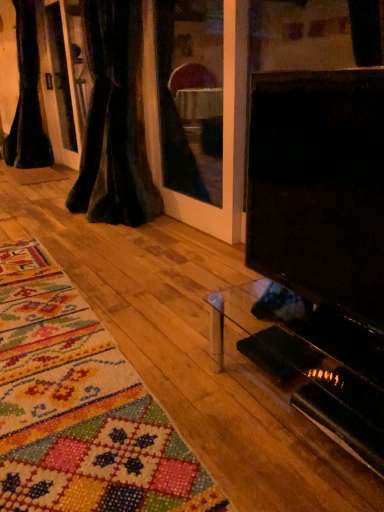
Image resolution: width=384 pixels, height=512 pixels. Describe the element at coordinates (114, 121) in the screenshot. I see `velvet dark at left, arranged as the 2th curtain when viewed from the left` at that location.

The image size is (384, 512). What are the coordinates of `velvet dark at left, arranged as the 2th curtain when viewed from the left` in the screenshot? It's located at (114, 121).

Describe the element at coordinates (319, 187) in the screenshot. I see `black glossy tv at right` at that location.

Where is `velvet dark at left, which appears as the 1th curtain when viewed from the right`? The image size is (384, 512). velvet dark at left, which appears as the 1th curtain when viewed from the right is located at coordinates (114, 121).

From the image's perspective, which one is positioned higher, black velvet curtain at left, arranged as the first curtain when viewed from the back, or black glossy tv at right?

black velvet curtain at left, arranged as the first curtain when viewed from the back, from the image's perspective.

Considering the sizes of black velvet curtain at left, marked as the 2th curtain in a front-to-back arrangement, and black glossy tv at right in the image, is black velvet curtain at left, marked as the 2th curtain in a front-to-back arrangement, taller or shorter than black glossy tv at right?

black velvet curtain at left, marked as the 2th curtain in a front-to-back arrangement, is taller than black glossy tv at right.

In the image, is black velvet curtain at left, the second curtain positioned from the right, positioned in front of or behind black glossy tv at right?

In the image, black velvet curtain at left, the second curtain positioned from the right, appears behind black glossy tv at right.

Where is `screen in front of the black velvet curtain at left, the first curtain viewed from the left`? The width and height of the screenshot is (384, 512). screen in front of the black velvet curtain at left, the first curtain viewed from the left is located at coordinates (319, 187).

Are velvet dark at left, which is the 2th curtain in back-to-front order, and black glossy tv at right beside each other?

They are not placed beside each other.

Can we say velvet dark at left, which appears as the 1th curtain when viewed from the right, lies outside black glossy tv at right?

Indeed, velvet dark at left, which appears as the 1th curtain when viewed from the right, is completely outside black glossy tv at right.

From a real-world perspective, is velvet dark at left, which is the 2th curtain in back-to-front order, physically below black glossy tv at right?

No, from a real-world perspective, velvet dark at left, which is the 2th curtain in back-to-front order, is not under black glossy tv at right.

Based on their positions, is velvet dark at left, which appears as the 1th curtain when viewed from the right, located to the left or right of black glossy tv at right?

velvet dark at left, which appears as the 1th curtain when viewed from the right, is positioned on black glossy tv at right's left side.

In the scene shown: Is black glossy tv at right inside or outside of velvet dark at left, which appears as the 1th curtain when viewed from the right?

black glossy tv at right is not enclosed by velvet dark at left, which appears as the 1th curtain when viewed from the right.

In the scene shown: Considering the relative sizes of black glossy tv at right and velvet dark at left, which is the 2th curtain in back-to-front order, in the image provided, is black glossy tv at right smaller than velvet dark at left, which is the 2th curtain in back-to-front order,?

Yes, black glossy tv at right is smaller than velvet dark at left, which is the 2th curtain in back-to-front order.

From a real-world perspective, is black glossy tv at right below velvet dark at left, which is the first curtain in front-to-back order?

Yes, from a real-world perspective, black glossy tv at right is beneath velvet dark at left, which is the first curtain in front-to-back order.

In the scene shown: Considering the sizes of black glossy tv at right and velvet dark at left, arranged as the 2th curtain when viewed from the left, in the image, is black glossy tv at right taller or shorter than velvet dark at left, arranged as the 2th curtain when viewed from the left,?

In the image, black glossy tv at right appears to be shorter than velvet dark at left, arranged as the 2th curtain when viewed from the left.

From a real-world perspective, is black glossy tv at right beneath black velvet curtain at left, arranged as the first curtain when viewed from the back?

Correct, in the physical world, black glossy tv at right is lower than black velvet curtain at left, arranged as the first curtain when viewed from the back.

Looking at this image, how many degrees apart are the facing directions of black glossy tv at right and black velvet curtain at left, arranged as the first curtain when viewed from the back?

They differ by 0.000754 degrees in their facing directions.

Does black glossy tv at right have a greater height compared to black velvet curtain at left, the second curtain positioned from the right?

Incorrect, the height of black glossy tv at right is not larger of that of black velvet curtain at left, the second curtain positioned from the right.

Looking at this image, can you confirm if black glossy tv at right is thinner than black velvet curtain at left, marked as the 2th curtain in a front-to-back arrangement?

Correct, the width of black glossy tv at right is less than that of black velvet curtain at left, marked as the 2th curtain in a front-to-back arrangement.

Do you think black velvet curtain at left, the second curtain positioned from the right, is within velvet dark at left, arranged as the 2th curtain when viewed from the left, or outside of it?

black velvet curtain at left, the second curtain positioned from the right, is not inside velvet dark at left, arranged as the 2th curtain when viewed from the left, it's outside.

Between black velvet curtain at left, the first curtain viewed from the left, and velvet dark at left, which appears as the 1th curtain when viewed from the right, which one has more height?

Standing taller between the two is black velvet curtain at left, the first curtain viewed from the left.

From the image's perspective, is black velvet curtain at left, arranged as the first curtain when viewed from the back, above velvet dark at left, which is the 2th curtain in back-to-front order?

Indeed, from the image's perspective, black velvet curtain at left, arranged as the first curtain when viewed from the back, is shown above velvet dark at left, which is the 2th curtain in back-to-front order.

Does black velvet curtain at left, arranged as the first curtain when viewed from the back, have a greater width compared to velvet dark at left, which is the first curtain in front-to-back order?

Indeed, black velvet curtain at left, arranged as the first curtain when viewed from the back, has a greater width compared to velvet dark at left, which is the first curtain in front-to-back order.

Consider the image. Does velvet dark at left, which appears as the 1th curtain when viewed from the right, have a lesser height compared to black velvet curtain at left, arranged as the first curtain when viewed from the back?

Yes.

Is velvet dark at left, which appears as the 1th curtain when viewed from the right, touching black velvet curtain at left, the second curtain positioned from the right?

No, velvet dark at left, which appears as the 1th curtain when viewed from the right, is not beside black velvet curtain at left, the second curtain positioned from the right.

Considering the positions of objects velvet dark at left, which appears as the 1th curtain when viewed from the right, and black velvet curtain at left, the first curtain viewed from the left, in the image provided, who is behind, velvet dark at left, which appears as the 1th curtain when viewed from the right, or black velvet curtain at left, the first curtain viewed from the left,?

black velvet curtain at left, the first curtain viewed from the left.

From a real-world perspective, which is physically above, velvet dark at left, which is the 2th curtain in back-to-front order, or black velvet curtain at left, marked as the 2th curtain in a front-to-back arrangement?

black velvet curtain at left, marked as the 2th curtain in a front-to-back arrangement.

Where is `screen below the black velvet curtain at left, the second curtain positioned from the right (from the image's perspective)`? screen below the black velvet curtain at left, the second curtain positioned from the right (from the image's perspective) is located at coordinates (319, 187).

Where is `the 1st curtain counting from the left side of the black glossy tv at right`? This screenshot has height=512, width=384. the 1st curtain counting from the left side of the black glossy tv at right is located at coordinates (114, 121).

Considering their positions, is velvet dark at left, which is the first curtain in front-to-back order, positioned further to black glossy tv at right than black velvet curtain at left, the second curtain positioned from the right?

black velvet curtain at left, the second curtain positioned from the right.

When comparing their distances from black glossy tv at right, does black velvet curtain at left, marked as the 2th curtain in a front-to-back arrangement, or velvet dark at left, which appears as the 1th curtain when viewed from the right, seem closer?

velvet dark at left, which appears as the 1th curtain when viewed from the right.

Estimate the real-world distances between objects in this image. Which object is further from velvet dark at left, which is the 2th curtain in back-to-front order, black glossy tv at right or black velvet curtain at left, arranged as the first curtain when viewed from the back?

Among the two, black glossy tv at right is located further to velvet dark at left, which is the 2th curtain in back-to-front order.

Estimate the real-world distances between objects in this image. Which object is further from black velvet curtain at left, the first curtain viewed from the left, velvet dark at left, which is the first curtain in front-to-back order, or black glossy tv at right?

black glossy tv at right is positioned further to the anchor black velvet curtain at left, the first curtain viewed from the left.

Looking at this image, based on their spatial positions, is black glossy tv at right or velvet dark at left, which is the first curtain in front-to-back order, closer to black velvet curtain at left, the second curtain positioned from the right?

velvet dark at left, which is the first curtain in front-to-back order, lies closer to black velvet curtain at left, the second curtain positioned from the right, than the other object.

Based on their spatial positions, is black velvet curtain at left, arranged as the first curtain when viewed from the back, or black glossy tv at right closer to velvet dark at left, arranged as the 2th curtain when viewed from the left?

black velvet curtain at left, arranged as the first curtain when viewed from the back.

Where is `curtain between black glossy tv at right and black velvet curtain at left, the first curtain viewed from the left, in the front-back direction`? This screenshot has width=384, height=512. curtain between black glossy tv at right and black velvet curtain at left, the first curtain viewed from the left, in the front-back direction is located at coordinates (114, 121).